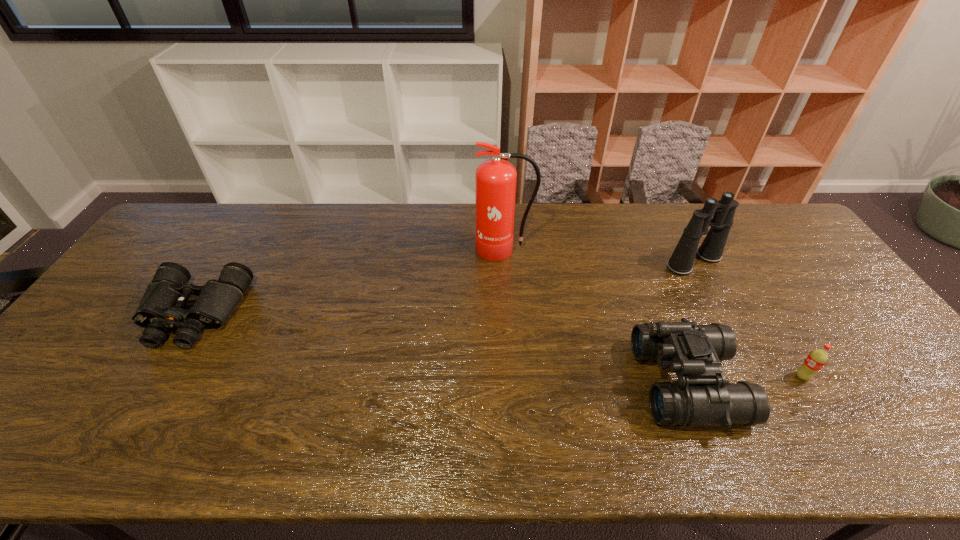
Find the location of a particular element. Image resolution: width=960 pixels, height=540 pixels. free spot at the near edge of the desktop is located at coordinates (370, 443).

This screenshot has width=960, height=540. In order to click on vacant position at the right edge of the desktop in this screenshot , I will do `click(816, 257)`.

Identify the location of vacant space at the near left corner of the desktop. (33, 451).

Find the location of a particular element. The height and width of the screenshot is (540, 960). blank region between the second tallest binoculars and the rightmost object is located at coordinates (745, 380).

This screenshot has width=960, height=540. What are the coordinates of `blank region between the second object from left to right and the rightmost object` in the screenshot? It's located at (653, 313).

You are a GUI agent. You are given a task and a screenshot of the screen. Output one action in this format:
    pyautogui.click(x=<x>, y=<y>)
    Task: Click on the vacant point located between the third shortest object and the fourth tallest object
    
    Given the screenshot: What is the action you would take?
    pyautogui.click(x=745, y=380)

At what (x,y) coordinates should I click in order to perform the action: click on free space between the farthest binoculars and the tallest object. Please return your answer as a coordinate pair (x, y). Looking at the image, I should click on (599, 255).

Find the location of `vacant area that lies between the tallest binoculars and the second object from left to right`. vacant area that lies between the tallest binoculars and the second object from left to right is located at coordinates (599, 255).

You are a GUI agent. You are given a task and a screenshot of the screen. Output one action in this format:
    pyautogui.click(x=<x>, y=<y>)
    Task: Click on the vacant space in between the third tallest object and the fourth object from right to left
    
    Given the screenshot: What is the action you would take?
    pyautogui.click(x=596, y=316)

Where is `empty space that is in between the fourth tallest object and the shortest binoculars`? empty space that is in between the fourth tallest object and the shortest binoculars is located at coordinates (498, 345).